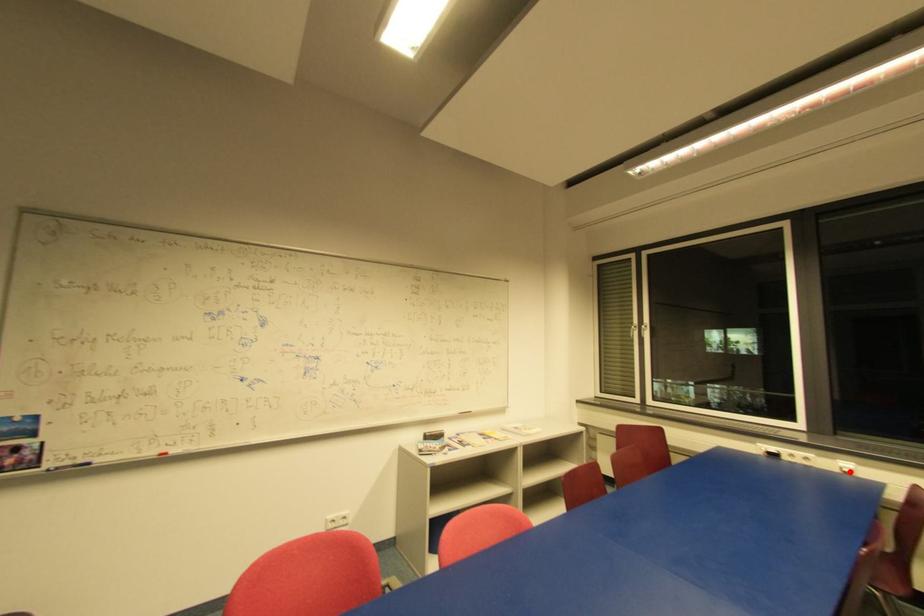
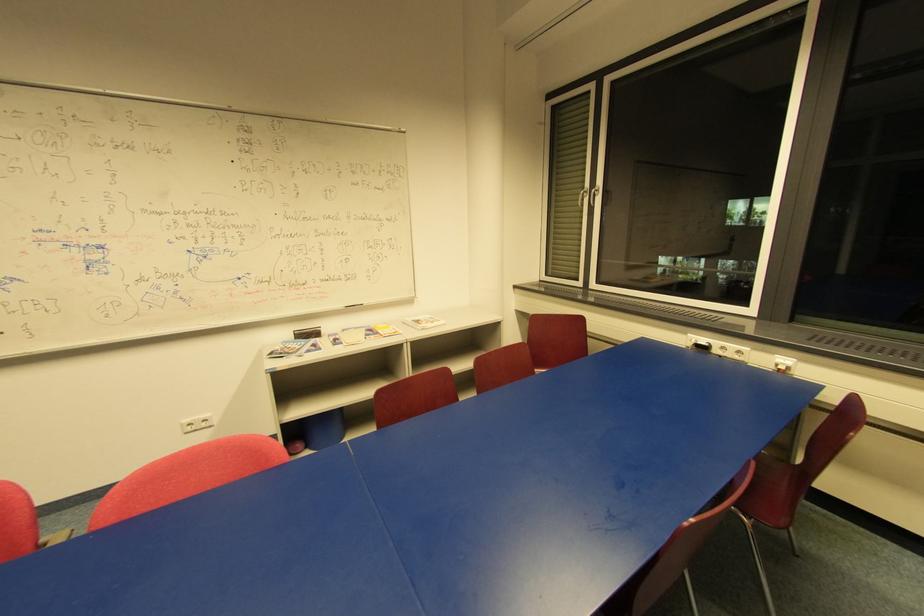
Question: I am providing you with two images of the same scene from different viewpoints. Image1 has a red point marked. In image2, the corresponding 3D location appears at what relative position? Reply with the corresponding letter.

Choices:
 (A) Closer
 (B) Farther

Answer: (B)